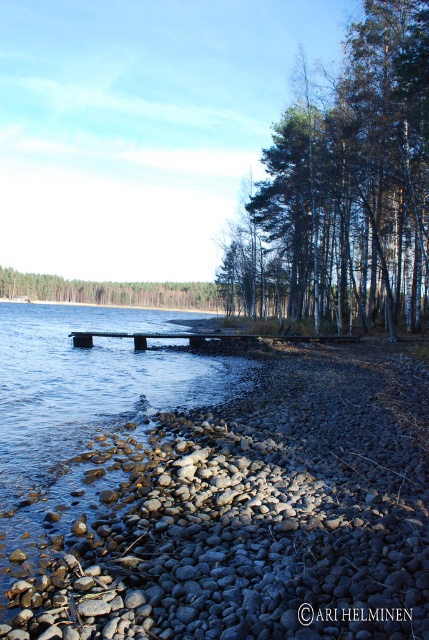
How far apart are gray smooth rocks at lower center and green leafy trees at center?

gray smooth rocks at lower center and green leafy trees at center are 90.03 meters apart.

Can you confirm if gray smooth rocks at lower center is positioned to the right of green leafy trees at center?

Correct, you'll find gray smooth rocks at lower center to the right of green leafy trees at center.

Describe the element at coordinates (253, 516) in the screenshot. Image resolution: width=429 pixels, height=640 pixels. I see `gray smooth rocks at lower center` at that location.

The width and height of the screenshot is (429, 640). What are the coordinates of `gray smooth rocks at lower center` in the screenshot? It's located at (253, 516).

How far apart are green leafy trees at right and green leafy trees at center?

green leafy trees at right and green leafy trees at center are 155.78 feet apart from each other.

Who is lower down, green leafy trees at right or green leafy trees at center?

green leafy trees at center

Describe the element at coordinates (346, 188) in the screenshot. Image resolution: width=429 pixels, height=640 pixels. I see `green leafy trees at right` at that location.

This screenshot has width=429, height=640. Identify the location of green leafy trees at right. (346, 188).

Where is `green leafy trees at right`? green leafy trees at right is located at coordinates (346, 188).